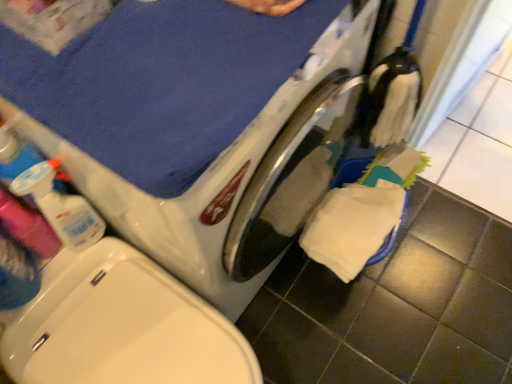
Question: From the image's perspective, is polished stainless steel washing machine at center under translucent plastic spray bottle at left?

Choices:
 (A) no
 (B) yes

Answer: (A)

Question: Is polished stainless steel washing machine at center facing away from translucent plastic spray bottle at left?

Choices:
 (A) yes
 (B) no

Answer: (B)

Question: From the image's perspective, is polished stainless steel washing machine at center over translucent plastic spray bottle at left?

Choices:
 (A) yes
 (B) no

Answer: (A)

Question: Considering the relative sizes of polished stainless steel washing machine at center and translucent plastic spray bottle at left in the image provided, is polished stainless steel washing machine at center smaller than translucent plastic spray bottle at left?

Choices:
 (A) yes
 (B) no

Answer: (B)

Question: Would you say translucent plastic spray bottle at left is part of polished stainless steel washing machine at center's contents?

Choices:
 (A) yes
 (B) no

Answer: (B)

Question: Does polished stainless steel washing machine at center appear on the right side of translucent plastic spray bottle at left?

Choices:
 (A) yes
 (B) no

Answer: (A)

Question: Is polished stainless steel washing machine at center surrounded by translucent plastic spray bottle at left?

Choices:
 (A) no
 (B) yes

Answer: (A)

Question: Does translucent plastic spray bottle at left lie behind polished stainless steel washing machine at center?

Choices:
 (A) yes
 (B) no

Answer: (A)

Question: Considering the relative sizes of translucent plastic spray bottle at left and polished stainless steel washing machine at center in the image provided, is translucent plastic spray bottle at left smaller than polished stainless steel washing machine at center?

Choices:
 (A) no
 (B) yes

Answer: (B)

Question: From a real-world perspective, is translucent plastic spray bottle at left positioned over polished stainless steel washing machine at center based on gravity?

Choices:
 (A) no
 (B) yes

Answer: (B)

Question: Is the position of translucent plastic spray bottle at left less distant than that of polished stainless steel washing machine at center?

Choices:
 (A) yes
 (B) no

Answer: (B)

Question: Is translucent plastic spray bottle at left facing towards polished stainless steel washing machine at center?

Choices:
 (A) yes
 (B) no

Answer: (B)

Question: In terms of height, does polished stainless steel washing machine at center look taller or shorter compared to translucent plastic spray bottle at left?

Choices:
 (A) short
 (B) tall

Answer: (B)